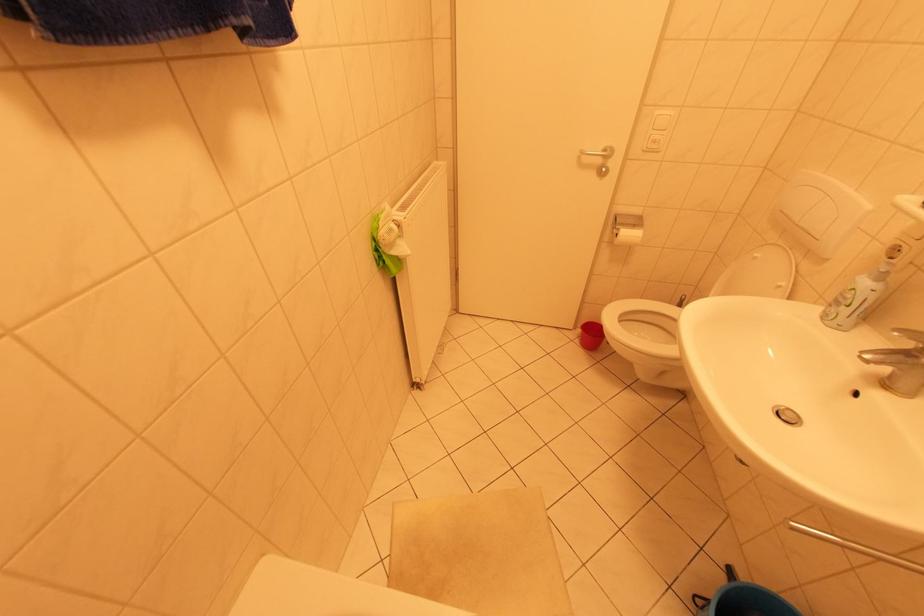
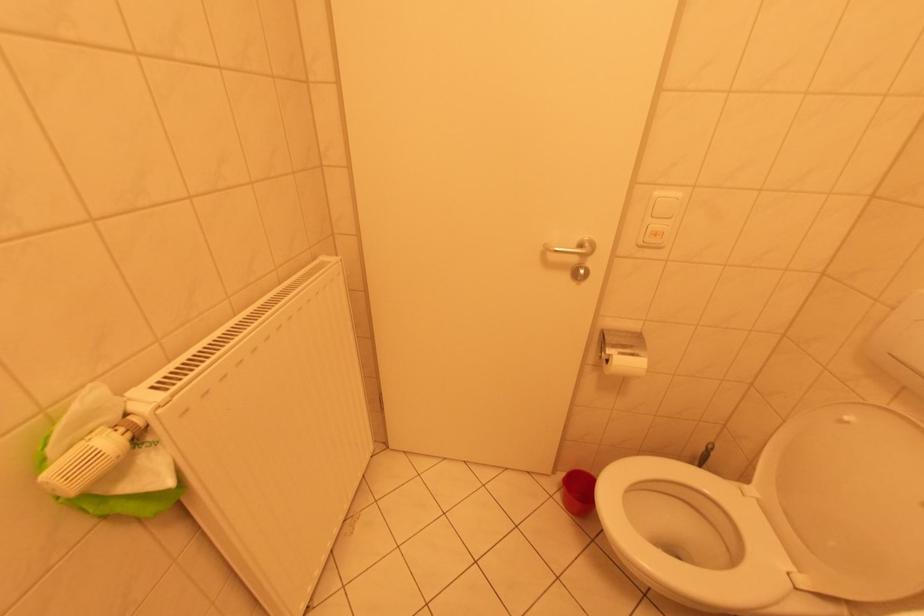
The images are taken continuously from a first-person perspective. In which direction are you moving?

The cameraman moved toward right, forward.